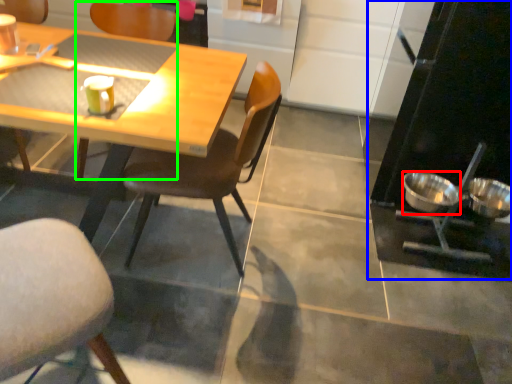
Question: Which is nearer to the bowl (highlighted by a red box)? appliance (highlighted by a blue box) or chair (highlighted by a green box).

Choices:
 (A) appliance
 (B) chair

Answer: (A)